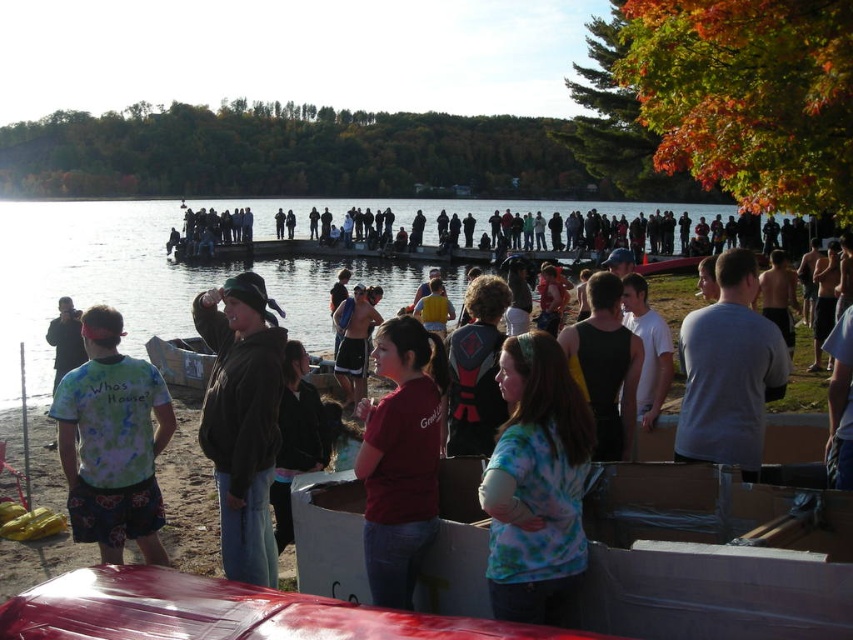
The height and width of the screenshot is (640, 853). Find the location of `clear water at center`. clear water at center is located at coordinates (88, 278).

Which is below, clear water at center or gray cotton shirt at right?

gray cotton shirt at right

Locate an element on the screen. The image size is (853, 640). clear water at center is located at coordinates coord(88,278).

Between point (120, 416) and point (194, 371), which one is positioned in front?

Positioned in front is point (120, 416).

Where is `tie-dye fabric shirt at left`? The height and width of the screenshot is (640, 853). tie-dye fabric shirt at left is located at coordinates (112, 442).

The height and width of the screenshot is (640, 853). What do you see at coordinates (112, 442) in the screenshot?
I see `tie-dye fabric shirt at left` at bounding box center [112, 442].

Identify the location of tie-dye fabric shirt at left. (112, 442).

Measure the distance between matte black people at center and camera.

The distance of matte black people at center from camera is 41.90 meters.

Does matte black people at center appear on the left side of white cotton shirt at right?

Indeed, matte black people at center is positioned on the left side of white cotton shirt at right.

Where is `matte black people at center`? matte black people at center is located at coordinates (352, 241).